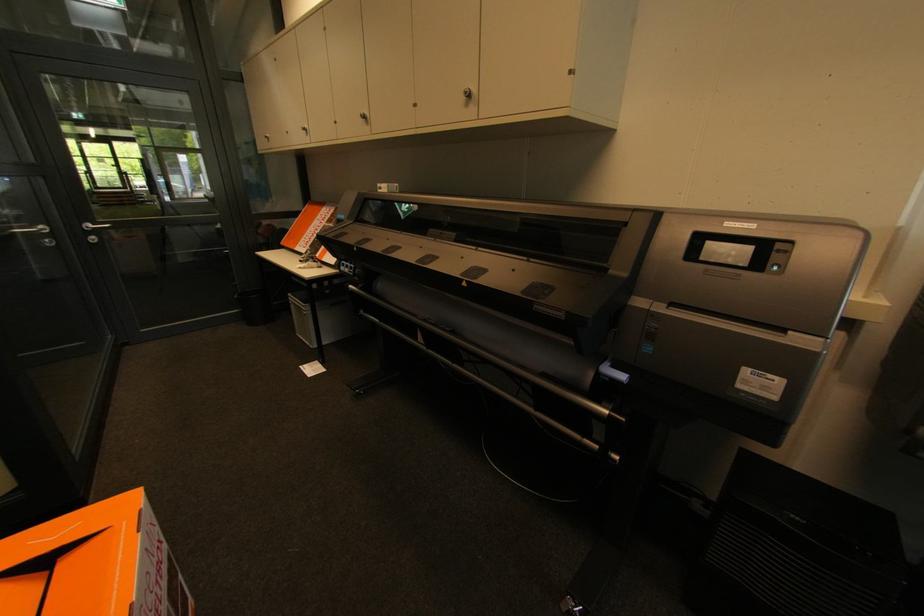
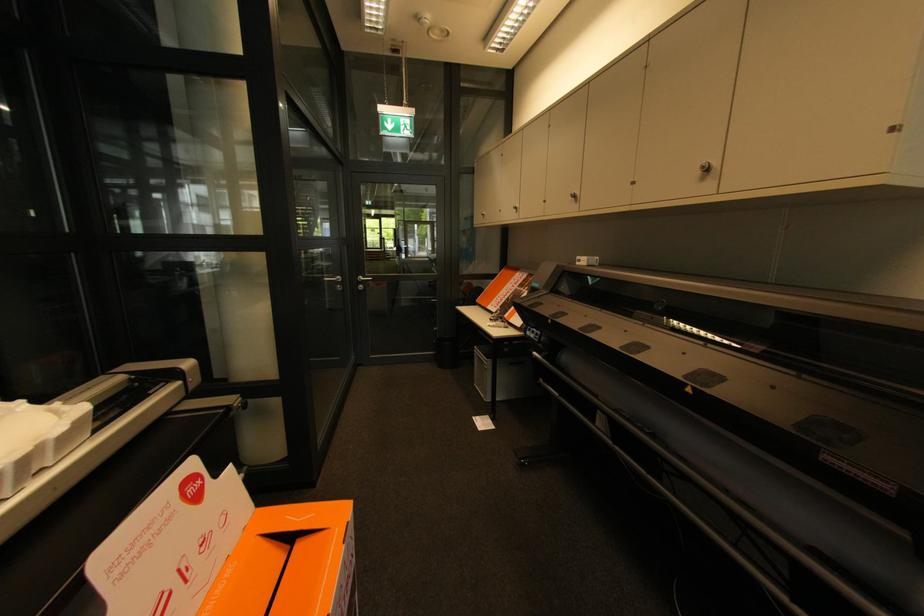
Where in the second image is the point corresponding to the point at 96,238 from the first image?

(365, 286)